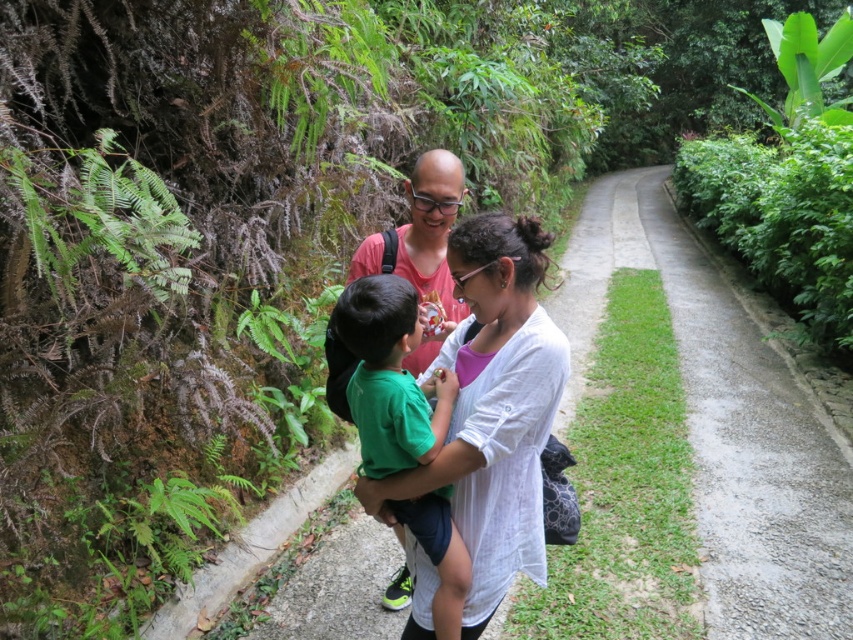
Question: From the image, what is the correct spatial relationship of gravel path at right in relation to white cotton shirt at center?

Choices:
 (A) right
 (B) left

Answer: (A)

Question: Which point is closer to the camera?

Choices:
 (A) gravel path at right
 (B) green cotton shirt at center
 (C) green leafy fern at left
 (D) white cotton shirt at center

Answer: (B)

Question: Is gravel path at right positioned behind white cotton shirt at center?

Choices:
 (A) no
 (B) yes

Answer: (B)

Question: Which point is closer to the camera?

Choices:
 (A) (28, 172)
 (B) (450, 392)
 (C) (480, 536)

Answer: (B)

Question: Is gravel path at right positioned in front of white cotton shirt at center?

Choices:
 (A) yes
 (B) no

Answer: (B)

Question: Estimate the real-world distances between objects in this image. Which object is farther from the green cotton shirt at center?

Choices:
 (A) green leafy fern at left
 (B) gravel path at right

Answer: (B)